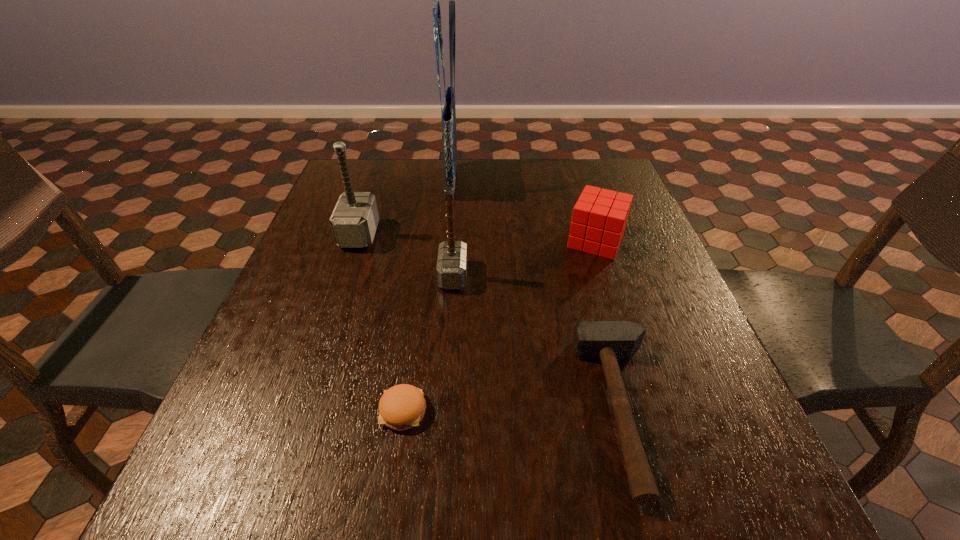
Image resolution: width=960 pixels, height=540 pixels. Identify the location of vacant region that satisfies the following two spatial constraints: 1. for striking with the head of the third shortest object; 2. on the left side of the leftmost object. (357, 241).

Identify the location of free space that satisfies the following two spatial constraints: 1. on the striking surface of the nearest hammer; 2. on the front side of the shortest object. (624, 411).